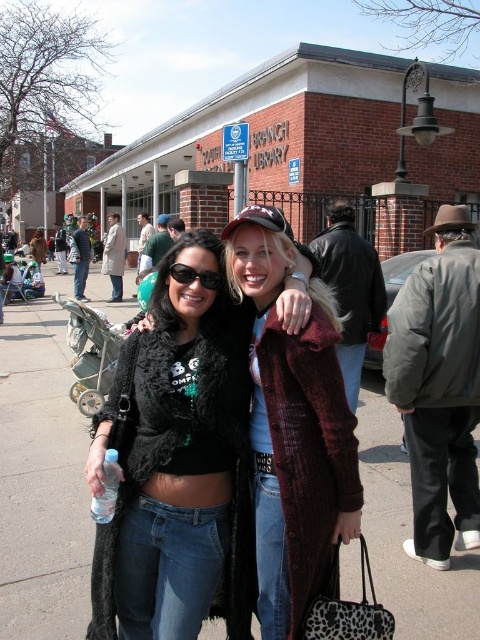
You are a photographer adjusting your camera settings. You notice the clear plastic bottle at lower left and the sunglasses at center in the frame. Which object is positioned more to the left?

The clear plastic bottle at lower left is positioned more to the left than the sunglasses at center.

You are standing at the entrance of the Branch Library and notice a clear plastic bottle at lower left. Where exactly is the clear plastic bottle located in relation to the entrance?

The clear plastic bottle at lower left is located at point [107,488] relative to the entrance.